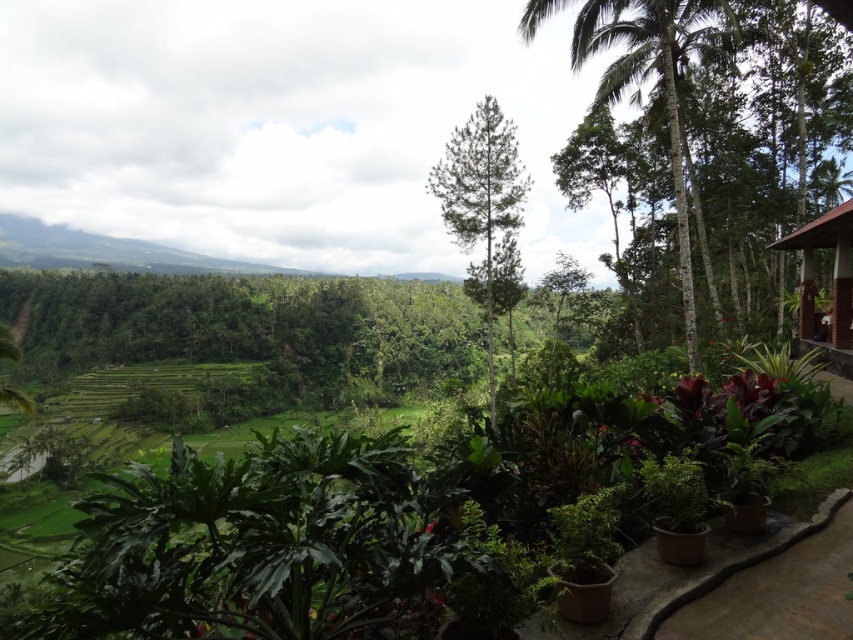
Question: In this image, where is green textured palm tree at upper right located relative to green leafy palm tree at center?

Choices:
 (A) below
 (B) above

Answer: (B)

Question: Is green textured palm tree at upper right positioned before green leafy palm tree at center?

Choices:
 (A) yes
 (B) no

Answer: (A)

Question: Estimate the real-world distances between objects in this image. Which object is closer to the green leafy palm tree at center?

Choices:
 (A) brown wooden hut at right
 (B) brown concrete path at lower right

Answer: (A)

Question: Which point is farther to the camera?

Choices:
 (A) green leafy palm tree at center
 (B) brown wooden hut at right
 (C) green textured palm tree at upper right

Answer: (A)

Question: Which of the following is the closest to the observer?

Choices:
 (A) (814, 246)
 (B) (445, 156)
 (C) (824, 592)

Answer: (C)

Question: Can you confirm if brown concrete path at lower right is positioned to the left of green leafy palm tree at center?

Choices:
 (A) no
 (B) yes

Answer: (B)